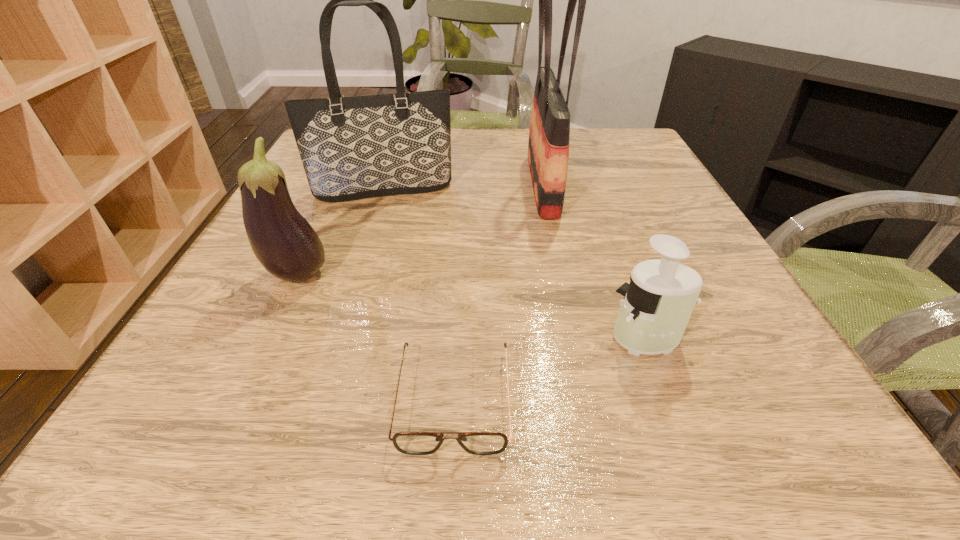
Locate an element on the screen. This screenshot has height=540, width=960. vacant space at the right edge of the desktop is located at coordinates (669, 198).

The image size is (960, 540). Find the location of `vacant area at the near left corner`. vacant area at the near left corner is located at coordinates (170, 392).

At what (x,y) coordinates should I click in order to perform the action: click on free location at the near right corner. Please return your answer as a coordinate pair (x, y). This screenshot has height=540, width=960. Looking at the image, I should click on (740, 417).

Where is `free point between the fourth object from left to right and the fourth tallest object`? This screenshot has width=960, height=540. free point between the fourth object from left to right and the fourth tallest object is located at coordinates coord(594,262).

Locate an element on the screen. empty location between the tote bag and the shortest object is located at coordinates (420, 294).

This screenshot has height=540, width=960. What are the coordinates of `blank region between the shortest object and the third nearest object` in the screenshot? It's located at (376, 336).

At what (x,y) coordinates should I click in order to perform the action: click on vacant area that lies between the fourth tallest object and the tote bag. Please return your answer as a coordinate pair (x, y). The height and width of the screenshot is (540, 960). Looking at the image, I should click on (516, 264).

Image resolution: width=960 pixels, height=540 pixels. In order to click on vacant area between the eggplant and the tote bag in this screenshot , I will do `click(341, 233)`.

Locate an element on the screen. This screenshot has height=540, width=960. vacant area that lies between the juicer and the second object from right to left is located at coordinates (594, 262).

This screenshot has width=960, height=540. I want to click on vacant area that lies between the third tallest object and the rightmost object, so 472,307.